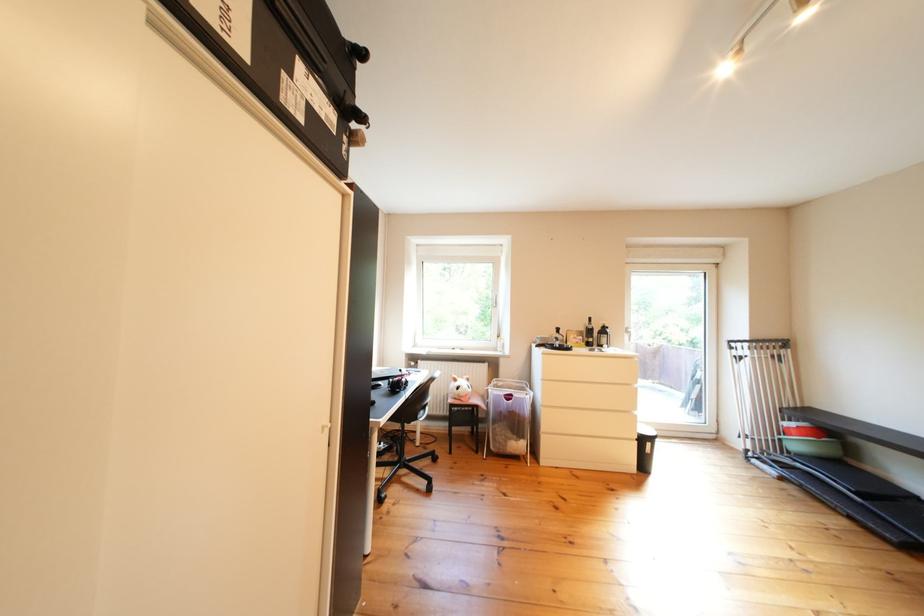
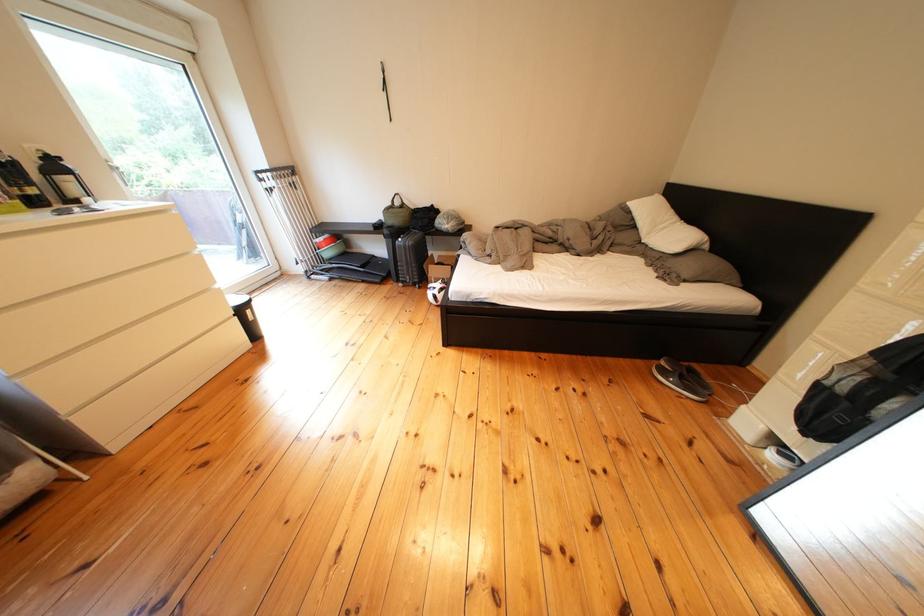
Locate, in the second image, the point that corresponds to [708,400] in the first image.

(259, 248)